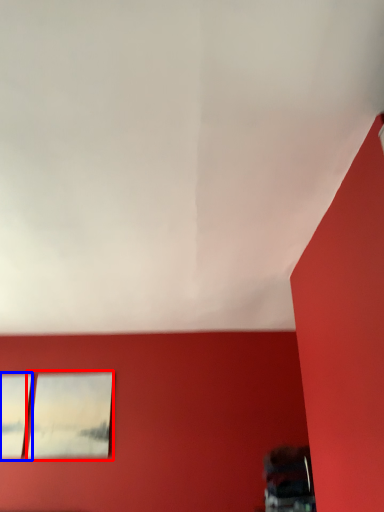
Question: Which of the following is the closest to the observer, picture frame (highlighted by a red box) or window (highlighted by a blue box)?

Choices:
 (A) picture frame
 (B) window

Answer: (B)